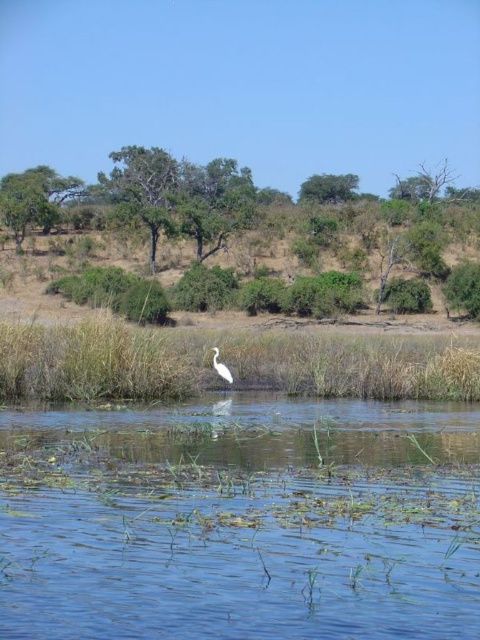
Who is more forward, (123, 365) or (324, 195)?

Point (123, 365) is more forward.

Measure the distance between green grass at lower center and green leafy tree at upper center.

The distance of green grass at lower center from green leafy tree at upper center is 65.56 meters.

Is point (153, 364) positioned in front of point (352, 173)?

Yes, point (153, 364) is closer to viewer.

Where is `green grass at lower center`? green grass at lower center is located at coordinates (100, 362).

Is the position of green leafy tree at upper center more distant than that of white glossy bird at center?

That is True.

Identify the location of green leafy tree at upper center. This screenshot has width=480, height=640. (328, 188).

Which is behind, point (452, 570) or point (464, 387)?

The point (464, 387) is more distant.

Where is `clear blue water at center`? The width and height of the screenshot is (480, 640). clear blue water at center is located at coordinates coord(240,520).